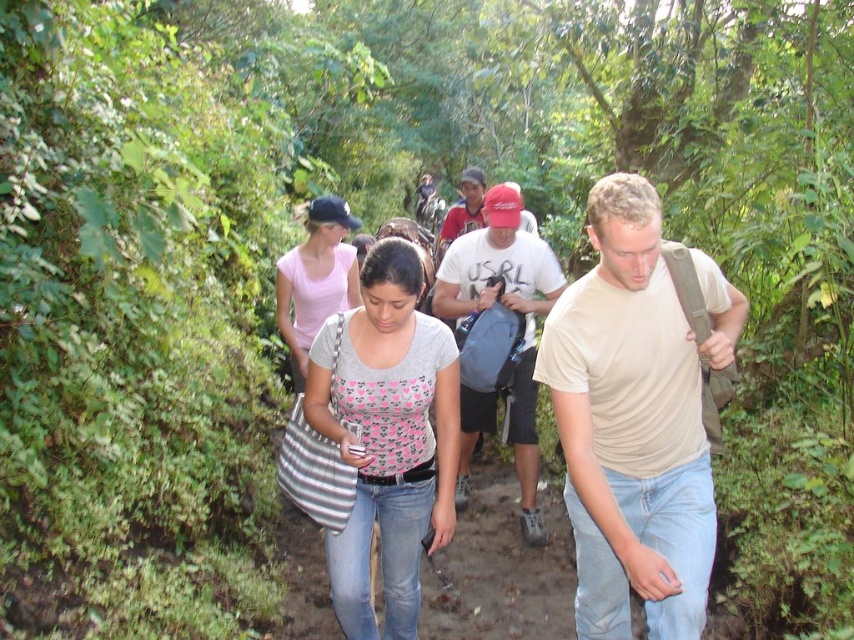
You are a hiker trying to identify the tallest person in the group. Looking at the beige cotton shirt at center and the pink cotton shirt at center, which one is taller?

The beige cotton shirt at center is taller than the pink cotton shirt at center.

You are a hiker trying to decide whether to carry both the gray printed shirt at center and the matte gray backpack at center on your hike. Given the narrow path, will the combined width of both items fit within the path if you carry them side by side?

The gray printed shirt at center is thinner than the matte gray backpack at center. However, the combined width of both items would depend on their individual thicknesses. Since the path is narrow, it is uncertain if they will fit without overlapping or causing difficulty navigating the path.